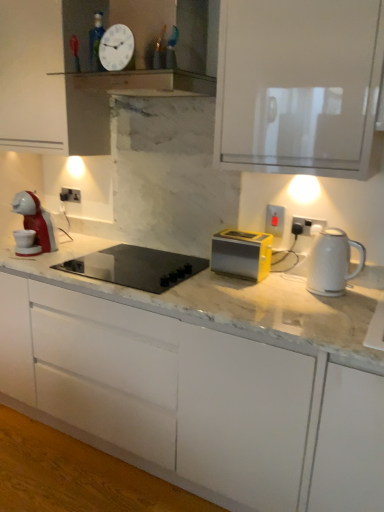
Question: From the image's perspective, does matte plastic electric outlet at center-right, which is the second electric outlet in left-to-right order, appear lower than white glossy electric kettle at right?

Choices:
 (A) yes
 (B) no

Answer: (B)

Question: Does matte plastic electric outlet at center-right, the second electric outlet in the front-to-back sequence, have a greater width compared to white glossy electric kettle at right?

Choices:
 (A) yes
 (B) no

Answer: (B)

Question: Is matte plastic electric outlet at center-right, arranged as the second electric outlet when viewed from the right, facing away from white glossy electric kettle at right?

Choices:
 (A) yes
 (B) no

Answer: (B)

Question: Does matte plastic electric outlet at center-right, the second electric outlet from the top, come in front of white glossy electric kettle at right?

Choices:
 (A) yes
 (B) no

Answer: (B)

Question: Can you confirm if matte plastic electric outlet at center-right, arranged as the second electric outlet when viewed from the right, is thinner than white glossy electric kettle at right?

Choices:
 (A) no
 (B) yes

Answer: (B)

Question: From a real-world perspective, is white glossy clock at upper center positioned above or below white matte cabinet at center?

Choices:
 (A) below
 (B) above

Answer: (B)

Question: Would you say white glossy clock at upper center is to the left or to the right of white matte cabinet at center in the picture?

Choices:
 (A) left
 (B) right

Answer: (A)

Question: Is point (127, 62) closer or farther from the camera than point (195, 357)?

Choices:
 (A) closer
 (B) farther

Answer: (B)

Question: In terms of width, does white glossy clock at upper center look wider or thinner when compared to white matte cabinet at center?

Choices:
 (A) wide
 (B) thin

Answer: (B)

Question: Is white glossy clock at upper center in front of or behind black glass cooktop at center in the image?

Choices:
 (A) front
 (B) behind

Answer: (A)

Question: Looking at their shapes, would you say white glossy clock at upper center is wider or thinner than black glass cooktop at center?

Choices:
 (A) wide
 (B) thin

Answer: (B)

Question: In terms of size, does white glossy clock at upper center appear bigger or smaller than black glass cooktop at center?

Choices:
 (A) small
 (B) big

Answer: (A)

Question: From the image's perspective, relative to black glass cooktop at center, is white glossy clock at upper center above or below?

Choices:
 (A) above
 (B) below

Answer: (A)

Question: From a real-world perspective, relative to white glossy electric kettle at right, is white glossy clock at upper center vertically above or below?

Choices:
 (A) above
 (B) below

Answer: (A)

Question: From the image's perspective, relative to white glossy electric kettle at right, is white glossy clock at upper center above or below?

Choices:
 (A) below
 (B) above

Answer: (B)